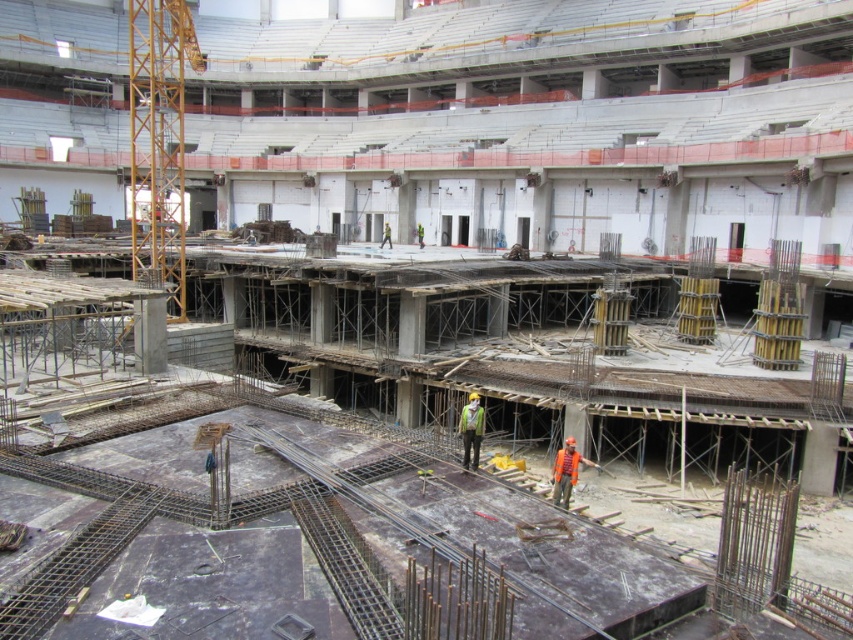
You are a safety inspector observing the construction site. You notice the orange reflective vest at center and the yellow metallic crane at left. Which object is closer to the crane?

The orange reflective vest at center is behind the yellow metallic crane at left, so the crane is closer to the inspector than the vest.

You are a safety inspector at the construction site. You notice two workers wearing orange reflective vest at center and green reflective safety vest at center. Which worker is closer to you?

The orange reflective vest at center is closer to you since it is in front of the green reflective safety vest at center.

From the picture: You are a safety inspector standing at the entrance of the construction site. You need to check the safety of the orange reflective vest at center. Can you clearly see the vest from your current position?

The orange reflective vest at center is 24.95 meters away from the viewer. Since reflective vests are designed to be visible from a distance, it is likely that the vest can be clearly seen from 24.95 meters away.